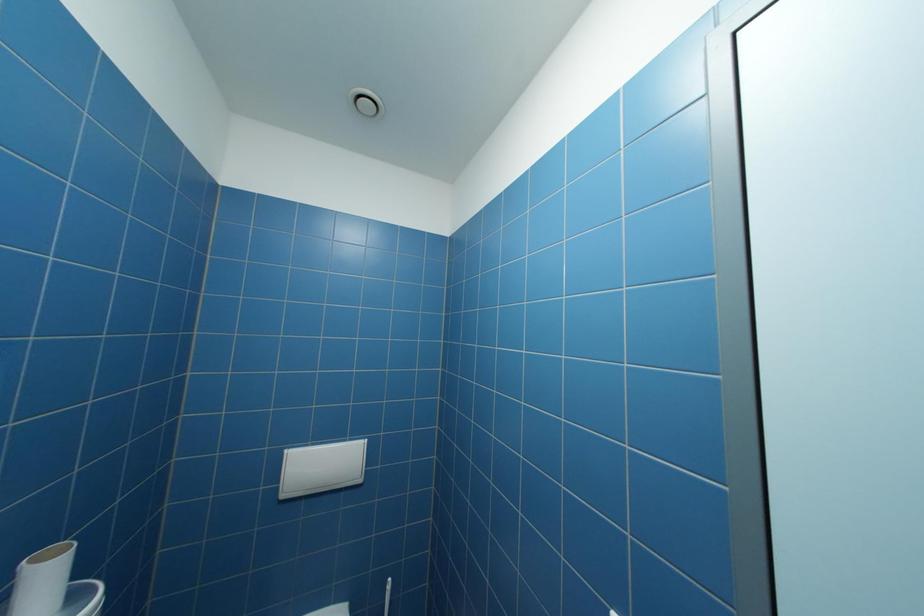
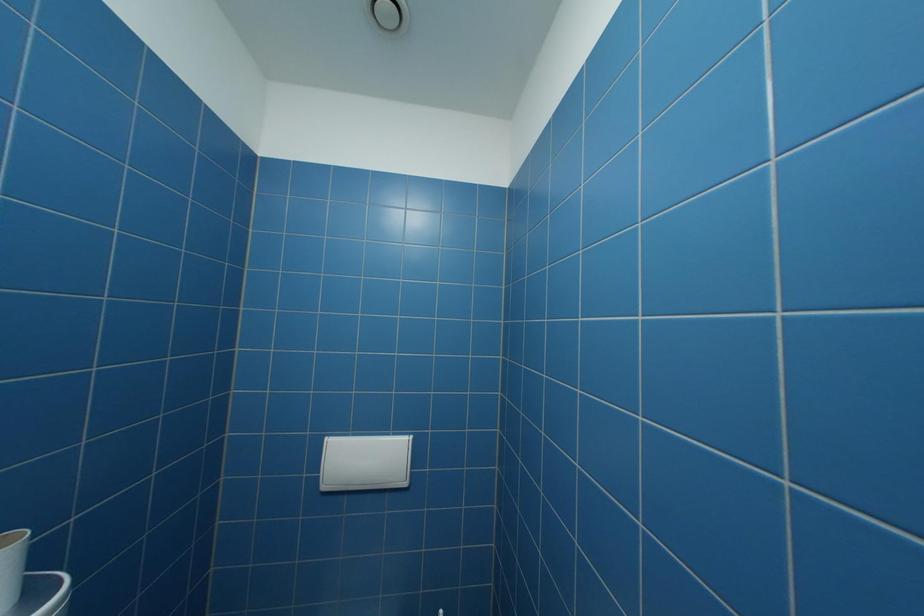
Question: The camera is either moving clockwise (left) or counter-clockwise (right) around the object. The first image is from the beginning of the video and the second image is from the end. Is the camera moving left or right when shooting the video?

Choices:
 (A) Left
 (B) Right

Answer: (B)